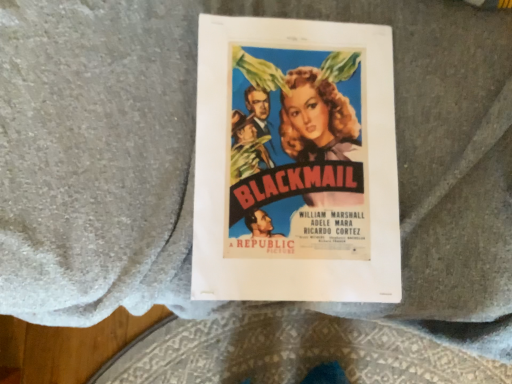
The width and height of the screenshot is (512, 384). What are the coordinates of `vacant area on top of matte paper poster at center (from a real-world perspective)` in the screenshot? It's located at (302, 164).